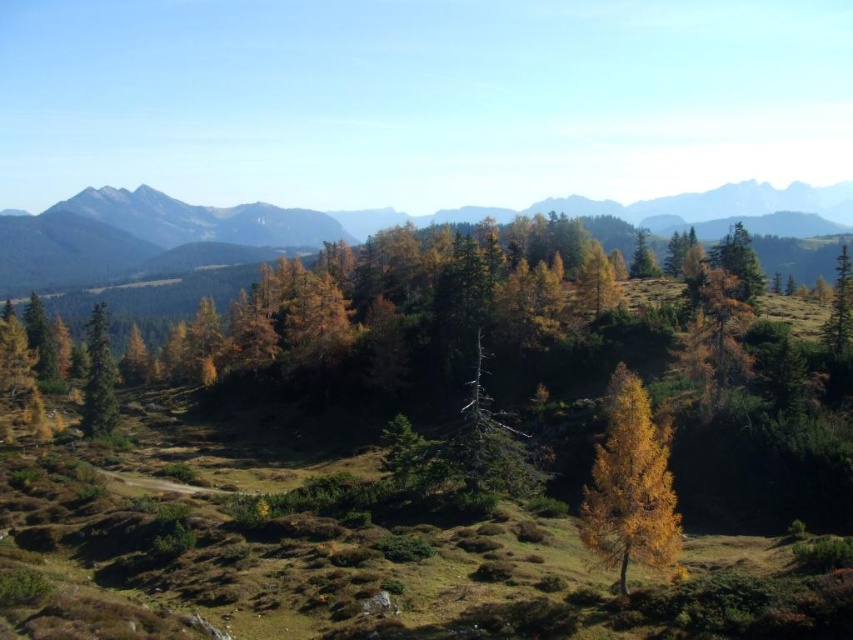
Question: Can you confirm if green textured mountain range at center is positioned to the right of green matte tree at left?

Choices:
 (A) no
 (B) yes

Answer: (B)

Question: Estimate the real-world distances between objects in this image. Which object is closer to the green textured mountain range at center?

Choices:
 (A) yellow larch tree at center
 (B) green matte tree at upper right
 (C) green matte tree at left
 (D) golden foliage at center

Answer: (D)

Question: Does green textured mountain range at center appear over yellow larch tree at center?

Choices:
 (A) no
 (B) yes

Answer: (B)

Question: Which of the following is the closest to the observer?

Choices:
 (A) (300, 252)
 (B) (635, 406)

Answer: (B)

Question: Among these points, which one is farthest from the camera?

Choices:
 (A) (837, 307)
 (B) (102, 426)
 (C) (457, 483)
 (D) (669, 493)

Answer: (B)

Question: Where is yellow larch tree at center located in relation to green matte tree at upper right in the image?

Choices:
 (A) below
 (B) above

Answer: (A)